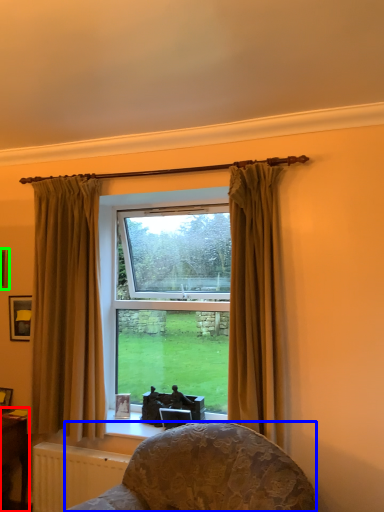
Question: Considering the real-world distances, which object is closest to table (highlighted by a red box)? furniture (highlighted by a blue box) or picture frame (highlighted by a green box).

Choices:
 (A) furniture
 (B) picture frame

Answer: (B)